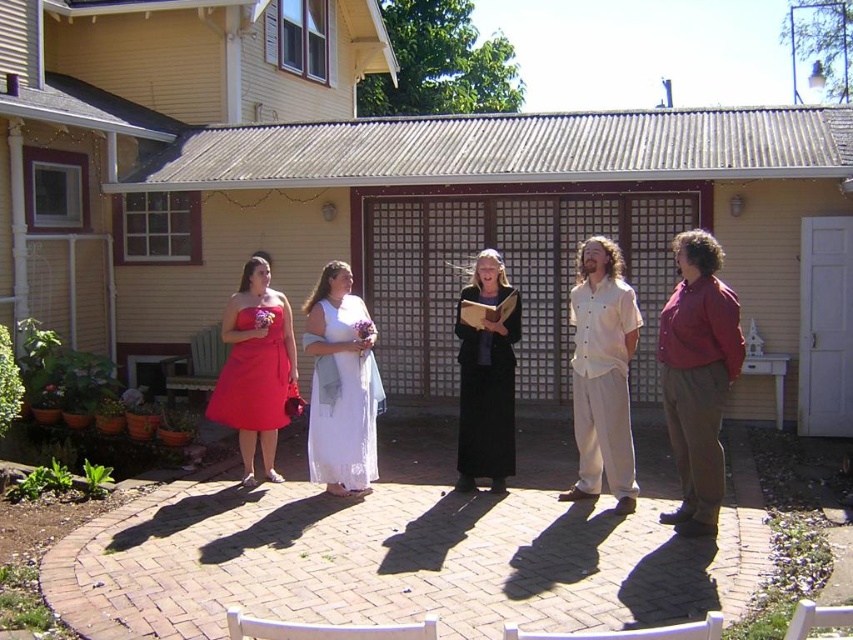
This screenshot has width=853, height=640. What do you see at coordinates (602, 372) in the screenshot?
I see `light beige cotton shirt at center` at bounding box center [602, 372].

Does light beige cotton shirt at center have a lesser height compared to black silk dress at center?

No, light beige cotton shirt at center is not shorter than black silk dress at center.

Who is more forward, (631,356) or (490,285)?

Point (631,356) is more forward.

Locate an element on the screen. This screenshot has height=640, width=853. light beige cotton shirt at center is located at coordinates (602, 372).

Who is more forward, (685,454) or (254,365)?

Point (685,454)

Is red cotton shirt at center further to camera compared to matte red dress at center?

No.

This screenshot has height=640, width=853. I want to click on red cotton shirt at center, so click(x=697, y=376).

Is black silk dress at center shorter than matte red dress at center?

In fact, black silk dress at center may be taller than matte red dress at center.

Can you confirm if black silk dress at center is thinner than matte red dress at center?

Yes.

Where is `black silk dress at center`? The width and height of the screenshot is (853, 640). black silk dress at center is located at coordinates (486, 380).